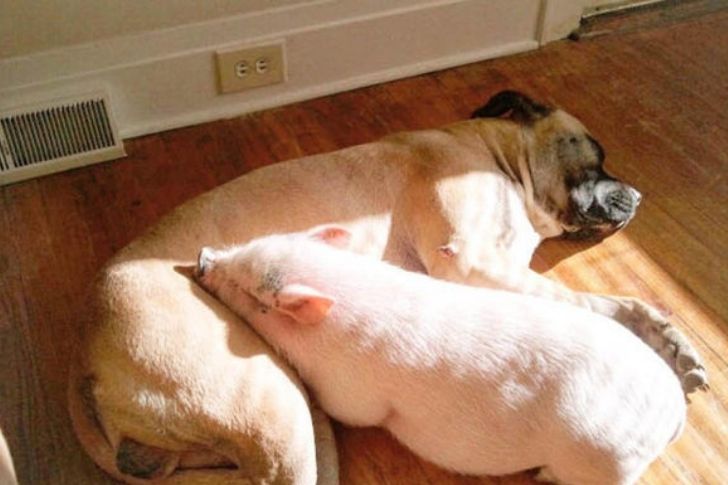
Where is `hardwood floor`? This screenshot has height=485, width=728. hardwood floor is located at coordinates (673, 101).